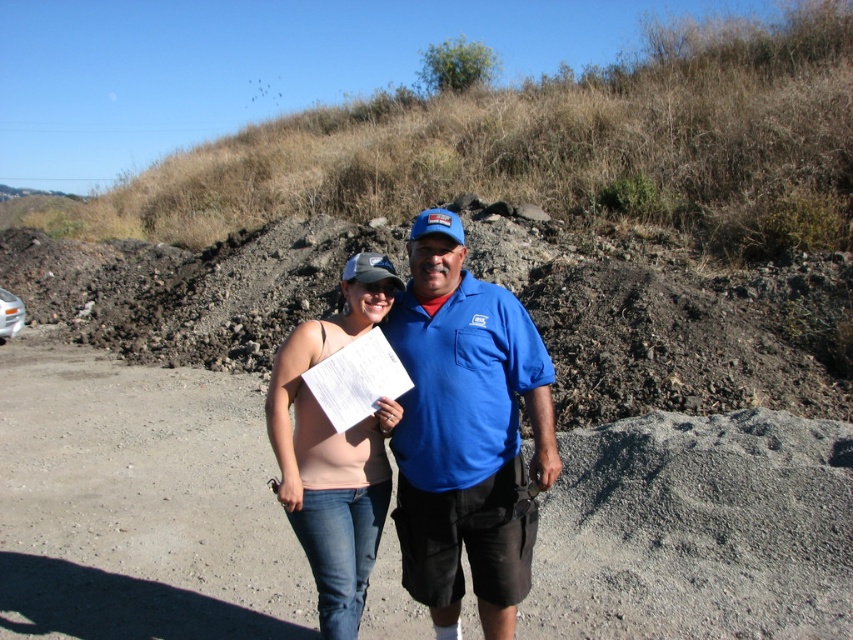
You are standing at the point marked as point (451, 284) on a construction site. You need to walk towards the large mound of dark soil or gravel in the background. How far will you have to walk to reach the base of the mound?

The distance between point (451, 284) and the viewer is 9.36 feet, so you will have to walk 9.36 feet to reach the base of the mound.

You are a safety inspector at the construction site. You need to ensure that the matte pink tank top at center is at least 3 meters away from the dirt track at center for safety reasons. Based on the image, is the current distance compliant with the safety requirement?

The dirt track at center is 2.41 meters away from the matte pink tank top at center, which is less than the required 3 meters. Therefore, the current distance does not comply with the safety requirement.

You are an observer standing in front of the two people at the construction site. You notice the blue cotton shirt at center and the matte pink tank top at center. Which of these two items is taller?

The blue cotton shirt at center is taller than the matte pink tank top at center according to the description.